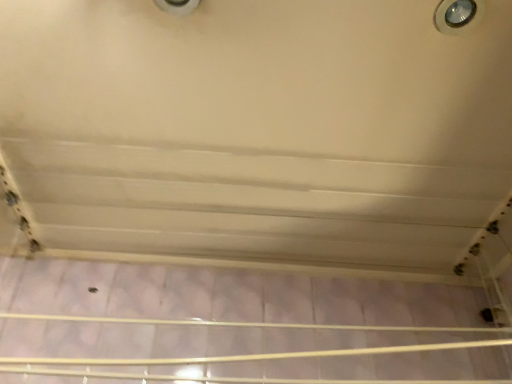
The width and height of the screenshot is (512, 384). Find the location of `free region on the left part of matte white light fixture at upper right`. free region on the left part of matte white light fixture at upper right is located at coordinates (369, 41).